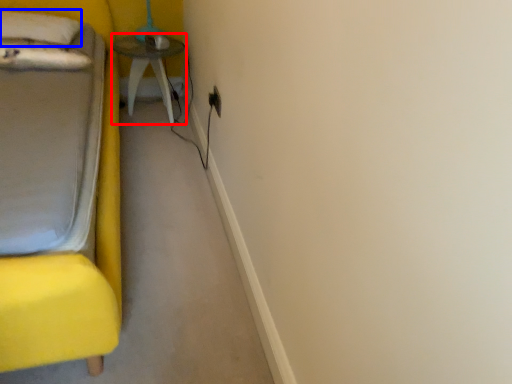
Question: Among these objects, which one is nearest to the camera, table (highlighted by a red box) or pillow (highlighted by a blue box)?

Choices:
 (A) table
 (B) pillow

Answer: (B)